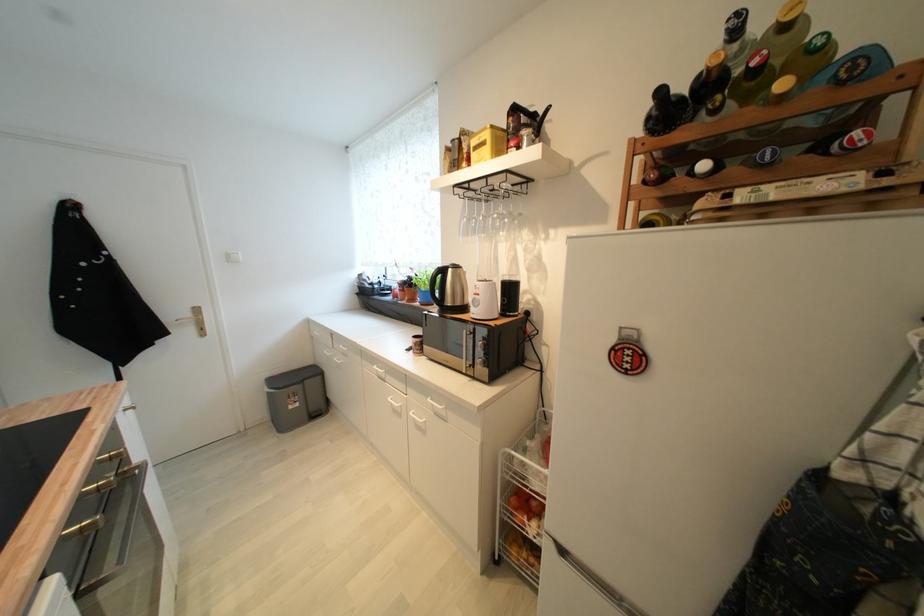
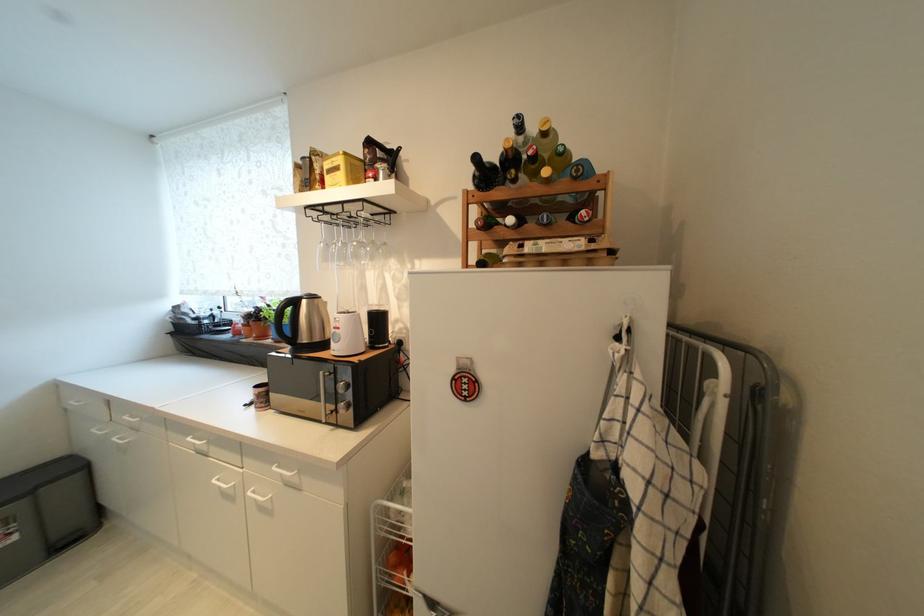
Question: The camera is either moving clockwise (left) or counter-clockwise (right) around the object. The first image is from the beginning of the video and the second image is from the end. Is the camera moving left or right when shooting the video?

Choices:
 (A) Left
 (B) Right

Answer: (A)